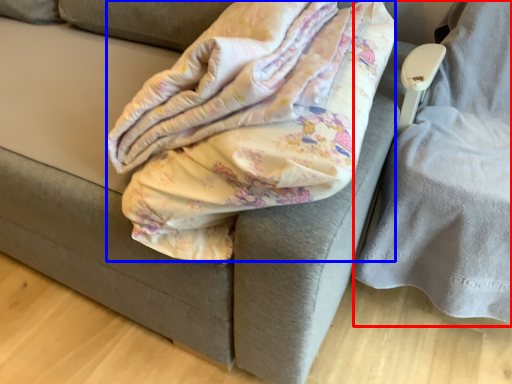
Question: Which point is further to the camera, swivel chair (highlighted by a red box) or blanket (highlighted by a blue box)?

Choices:
 (A) swivel chair
 (B) blanket

Answer: (A)